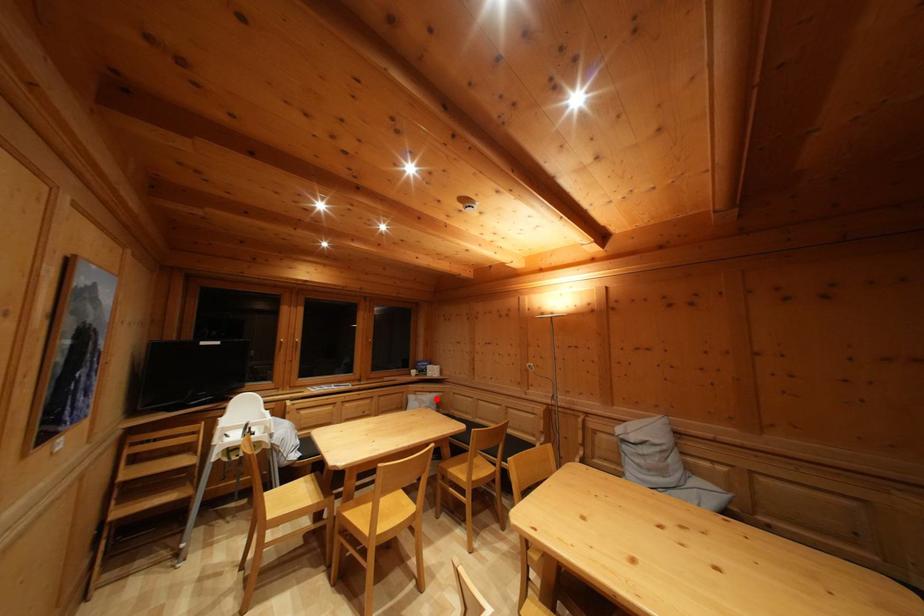
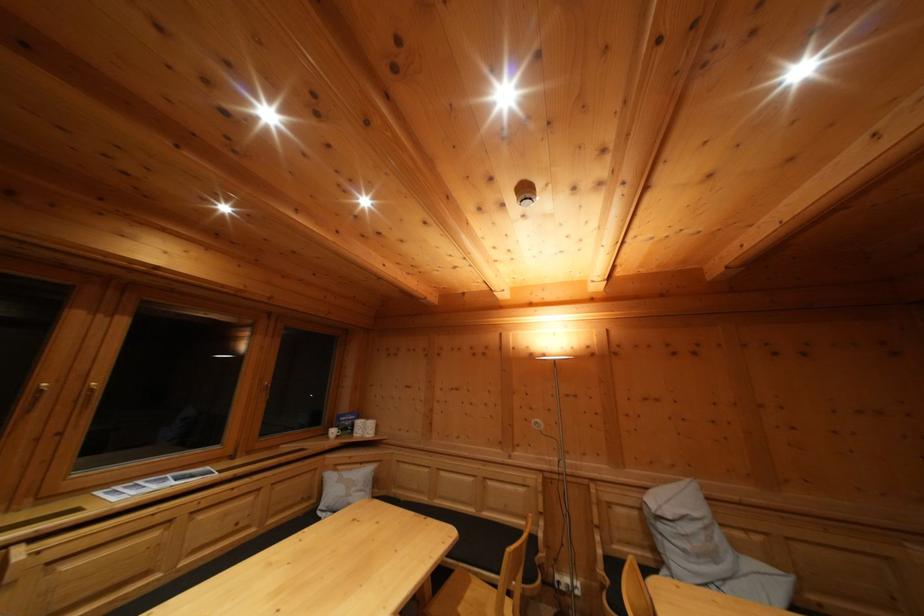
Question: A red point is marked in image1. In image2, is the corresponding 3D point closer to the camera or farther? Reply with the corresponding letter.

Choices:
 (A) The corresponding 3D point is closer.
 (B) The corresponding 3D point is farther.

Answer: (A)